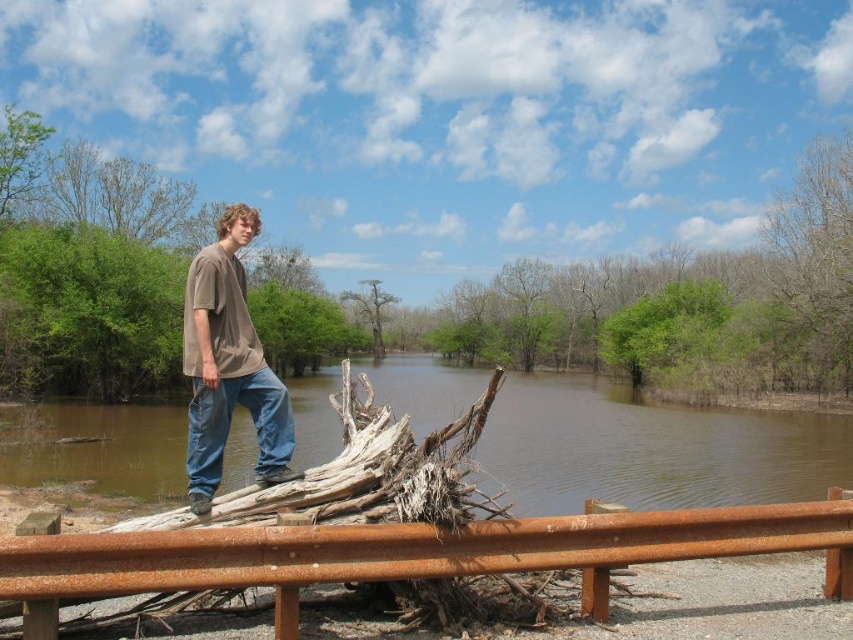
You are an environmental scientist assessing the biodiversity of this area. Based on the image, which tree, the green leafy tree at upper left or the smooth bark tree at center, would you prioritize for further study to understand the canopy structure?

The smooth bark tree at center should be prioritized for studying canopy structure since it is larger than the green leafy tree at upper left, indicating potential dominance in the area.